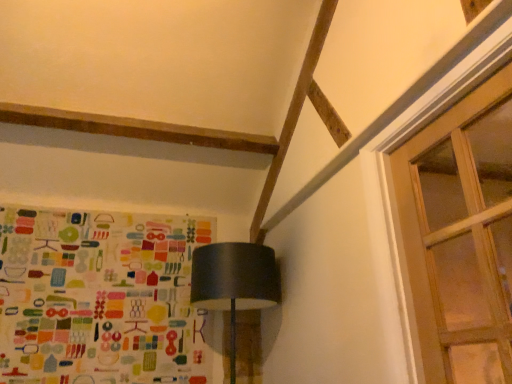
Image resolution: width=512 pixels, height=384 pixels. What do you see at coordinates (100, 298) in the screenshot?
I see `multicolored fabric at left` at bounding box center [100, 298].

You are a GUI agent. You are given a task and a screenshot of the screen. Output one action in this format:
    pyautogui.click(x=<x>, y=<y>)
    Task: Click on the matte black lampshade at center
    The height and width of the screenshot is (384, 512).
    Given the screenshot: What is the action you would take?
    pyautogui.click(x=234, y=282)

Is clear glass door at upper right to the left of multicolored fabric at left from the viewer's perspective?

No, clear glass door at upper right is not to the left of multicolored fabric at left.

How distant is clear glass door at upper right from multicolored fabric at left?

The distance of clear glass door at upper right from multicolored fabric at left is 7.35 feet.

From a real-world perspective, between clear glass door at upper right and multicolored fabric at left, who is vertically lower?

clear glass door at upper right, from a real-world perspective.

Is point (117, 234) farther from viewer compared to point (500, 327)?

Yes.

Is multicolored fabric at left looking in the opposite direction of clear glass door at upper right?

multicolored fabric at left is not turned away from clear glass door at upper right.

Looking at this image, considering the sizes of multicolored fabric at left and clear glass door at upper right in the image, is multicolored fabric at left taller or shorter than clear glass door at upper right?

Clearly, multicolored fabric at left is taller compared to clear glass door at upper right.

Is matte black lampshade at center situated inside multicolored fabric at left or outside?

matte black lampshade at center is spatially situated outside multicolored fabric at left.

Considering the positions of point (234, 351) and point (114, 256), is point (234, 351) closer or farther from the camera than point (114, 256)?

Clearly, point (234, 351) is closer to the camera than point (114, 256).

Is matte black lampshade at center oriented towards multicolored fabric at left?

No.

Which of these two, multicolored fabric at left or matte black lampshade at center, is bigger?

matte black lampshade at center is bigger.

Is multicolored fabric at left inside or outside of matte black lampshade at center?

multicolored fabric at left exists outside the volume of matte black lampshade at center.

Does multicolored fabric at left have a greater height compared to matte black lampshade at center?

Yes.

In terms of width, does multicolored fabric at left look wider or thinner when compared to matte black lampshade at center?

Clearly, multicolored fabric at left has less width compared to matte black lampshade at center.

Who is taller, clear glass door at upper right or matte black lampshade at center?

With more height is clear glass door at upper right.

Which object is wider, clear glass door at upper right or matte black lampshade at center?

With larger width is matte black lampshade at center.

Is clear glass door at upper right inside the boundaries of matte black lampshade at center, or outside?

clear glass door at upper right is spatially situated outside matte black lampshade at center.

Could you tell me if clear glass door at upper right is facing matte black lampshade at center?

No, clear glass door at upper right is not turned towards matte black lampshade at center.

Considering the relative positions of matte black lampshade at center and clear glass door at upper right in the image provided, is matte black lampshade at center to the right of clear glass door at upper right from the viewer's perspective?

Incorrect, matte black lampshade at center is not on the right side of clear glass door at upper right.

From the image's perspective, relative to clear glass door at upper right, is matte black lampshade at center above or below?

matte black lampshade at center is situated lower than clear glass door at upper right in the image.

Is matte black lampshade at center facing away from clear glass door at upper right?

No, matte black lampshade at center's orientation is not away from clear glass door at upper right.

Choose the correct answer: Is matte black lampshade at center inside clear glass door at upper right or outside it?

matte black lampshade at center is located beyond the bounds of clear glass door at upper right.

I want to click on print above the clear glass door at upper right (from a real-world perspective), so (100, 298).

I want to click on window in front of the multicolored fabric at left, so click(461, 235).

Looking at the image, which one is located closer to matte black lampshade at center, multicolored fabric at left or clear glass door at upper right?

multicolored fabric at left lies closer to matte black lampshade at center than the other object.

Based on the photo, based on their spatial positions, is clear glass door at upper right or matte black lampshade at center further from multicolored fabric at left?

Among the two, clear glass door at upper right is located further to multicolored fabric at left.

When comparing their distances from multicolored fabric at left, does matte black lampshade at center or clear glass door at upper right seem closer?

Among the two, matte black lampshade at center is located nearer to multicolored fabric at left.

Estimate the real-world distances between objects in this image. Which object is closer to clear glass door at upper right, multicolored fabric at left or matte black lampshade at center?

Among the two, matte black lampshade at center is located nearer to clear glass door at upper right.

From the image, which object appears to be nearer to matte black lampshade at center, clear glass door at upper right or multicolored fabric at left?

Among the two, multicolored fabric at left is located nearer to matte black lampshade at center.

From the image, which object appears to be nearer to clear glass door at upper right, matte black lampshade at center or multicolored fabric at left?

Based on the image, matte black lampshade at center appears to be nearer to clear glass door at upper right.

This screenshot has width=512, height=384. Find the location of `lamp between multicolored fabric at left and clear glass door at upper right`. lamp between multicolored fabric at left and clear glass door at upper right is located at coordinates (234, 282).